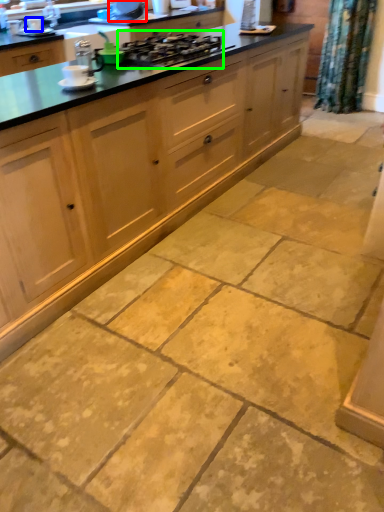
Question: Considering the real-world distances, which object is farthest from appliance (highlighted by a red box)? appliance (highlighted by a blue box) or gas stove (highlighted by a green box)?

Choices:
 (A) appliance
 (B) gas stove

Answer: (B)